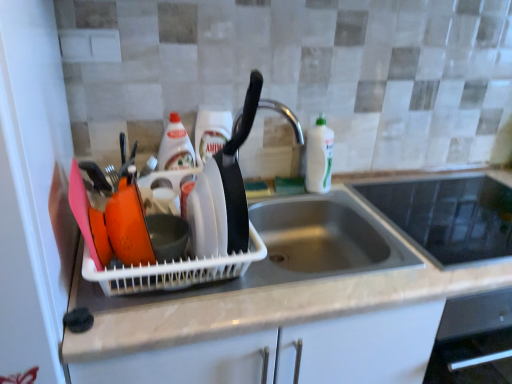
The width and height of the screenshot is (512, 384). What are the coordinates of `free spot in front of white glossy bottle at sink right, which is the 1th bottle from right to left` in the screenshot? It's located at (346, 204).